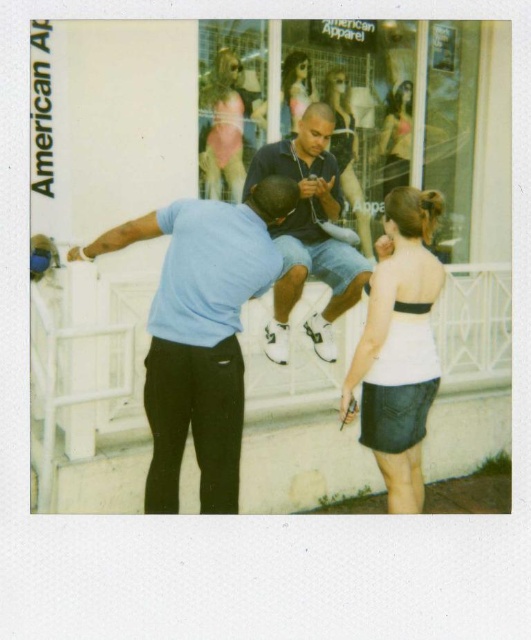
You are standing in front of the Polaroid photo and notice two people. The first person is wearing a light blue fabric shirt at left, and the second is wearing dark blue denim shorts at center. Which one is closer to you?

The light blue fabric shirt at left is closer to you because it is in front of the dark blue denim shorts at center.

You are standing in front of the Polaroid photo and notice two people wearing light blue fabric shirt at left and dark blue denim shorts at center. Which one is positioned lower in the image?

The light blue fabric shirt at left is positioned below the dark blue denim shorts at center, so the light blue fabric shirt at left is lower in the image.

From the picture: You are a fashion designer observing a photo shoot setup. In the image, there are two models wearing outfits. One is wearing a white strapless top at center and the other has dark blue denim shorts at center. According to the spatial arrangement in the photo, which outfit is positioned lower on the model?

The white strapless top at center is located below dark blue denim shorts at center, so the white strapless top at center is positioned lower on the model.